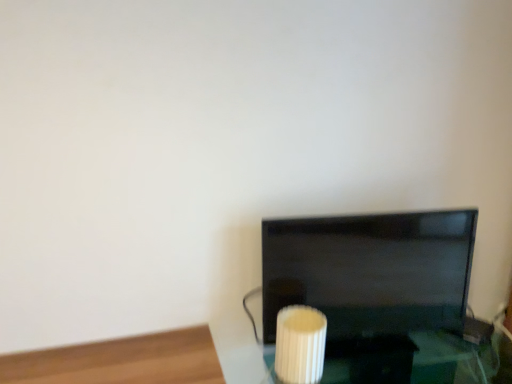
Question: Is black glossy tv at center to the right of white ribbed glass at lower center from the viewer's perspective?

Choices:
 (A) yes
 (B) no

Answer: (A)

Question: Is black glossy tv at center beside white ribbed glass at lower center?

Choices:
 (A) no
 (B) yes

Answer: (A)

Question: From a real-world perspective, is black glossy tv at center positioned under white ribbed glass at lower center based on gravity?

Choices:
 (A) yes
 (B) no

Answer: (B)

Question: Can we say black glossy tv at center lies outside white ribbed glass at lower center?

Choices:
 (A) yes
 (B) no

Answer: (A)

Question: Is black glossy tv at center facing towards white ribbed glass at lower center?

Choices:
 (A) yes
 (B) no

Answer: (A)

Question: Is black glossy tv at center to the left of white ribbed glass at lower center from the viewer's perspective?

Choices:
 (A) yes
 (B) no

Answer: (B)

Question: Is white ribbed glass at lower center facing towards black glossy tv at center?

Choices:
 (A) yes
 (B) no

Answer: (B)

Question: Is white ribbed glass at lower center behind black glossy tv at center?

Choices:
 (A) no
 (B) yes

Answer: (A)

Question: Considering the relative sizes of white ribbed glass at lower center and black glossy tv at center in the image provided, is white ribbed glass at lower center thinner than black glossy tv at center?

Choices:
 (A) no
 (B) yes

Answer: (A)

Question: From a real-world perspective, is white ribbed glass at lower center physically above black glossy tv at center?

Choices:
 (A) no
 (B) yes

Answer: (A)

Question: Could black glossy tv at center be considered to be inside white ribbed glass at lower center?

Choices:
 (A) yes
 (B) no

Answer: (B)

Question: Considering the relative sizes of white ribbed glass at lower center and black glossy tv at center in the image provided, is white ribbed glass at lower center smaller than black glossy tv at center?

Choices:
 (A) no
 (B) yes

Answer: (B)

Question: Considering their positions, is black glossy tv at center located in front of or behind white ribbed glass at lower center?

Choices:
 (A) behind
 (B) front

Answer: (A)